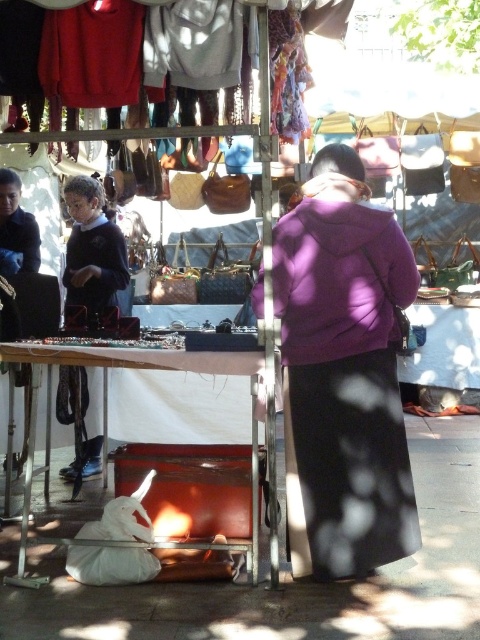
You are a customer at the flea market and want to place a scarf on the white leather table at lower center. The scarf is 20 inches long. Can you place it so that it hangs off the edge of the table without touching the purple matte jacket at center?

The purple matte jacket at center is 22.01 inches away from the white leather table at lower center. Since the scarf is only 20 inches long, placing it so that it hangs off the edge of the white leather table at lower center would not reach the purple matte jacket at center. Therefore, you can safely place the scarf on the table without it touching the jacket.

You are a customer at the flea market and want to place a small item on the purple matte jacket at center and the white leather table at lower center. Which surface can accommodate the item better?

The white leather table at lower center can accommodate the item better since it occupies more space than the purple matte jacket at center.

You are a customer at the flea market and want to place a small item on the purple matte jacket at center and the white leather table at lower center. Which surface has more space to accommodate the item?

The white leather table at lower center has more space since it has a greater width than the purple matte jacket at center.